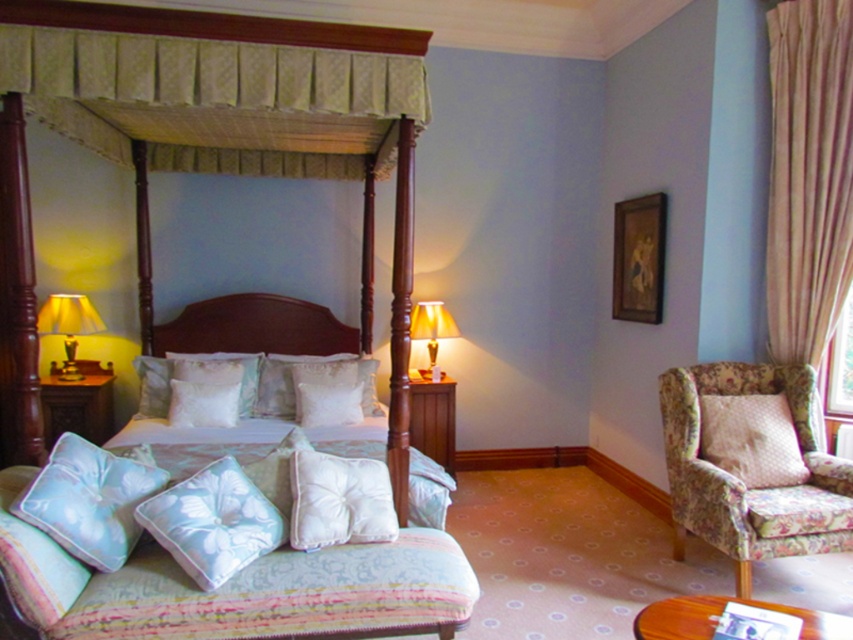
You are arranging flowers in the bedroom and want to place a vase on the dark wood headboard at center. However, there is already a light beige fabric pillow at center there. Can the pillow be moved to make space for the vase?

The dark wood headboard at center is positioned over the light beige fabric pillow at center, meaning the pillow is likely placed on the bed or surface below the headboard. You can move the pillow to another part of the bed or the nearby side table to make space for the vase on the headboard.